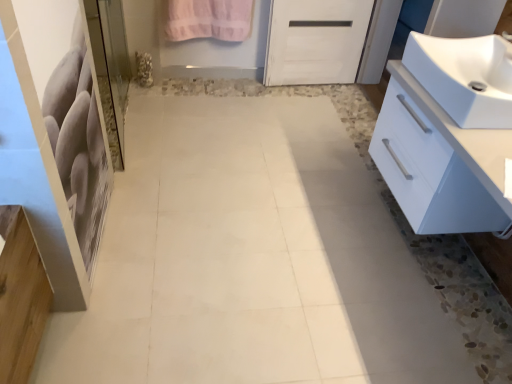
Question: Considering the positions of point (497, 41) and point (122, 87), is point (497, 41) closer or farther from the camera than point (122, 87)?

Choices:
 (A) closer
 (B) farther

Answer: (A)

Question: Looking at their shapes, would you say white glossy sink at right is wider or thinner than clear glass screen door at left?

Choices:
 (A) thin
 (B) wide

Answer: (B)

Question: Which object is positioned farthest from the pink cotton towel at upper center?

Choices:
 (A) white glossy sink at right
 (B) clear glass screen door at left
 (C) white glossy cabinet at right

Answer: (C)

Question: Considering the real-world distances, which object is farthest from the white glossy cabinet at right?

Choices:
 (A) clear glass screen door at left
 (B) white glossy sink at right
 (C) pink cotton towel at upper center

Answer: (C)